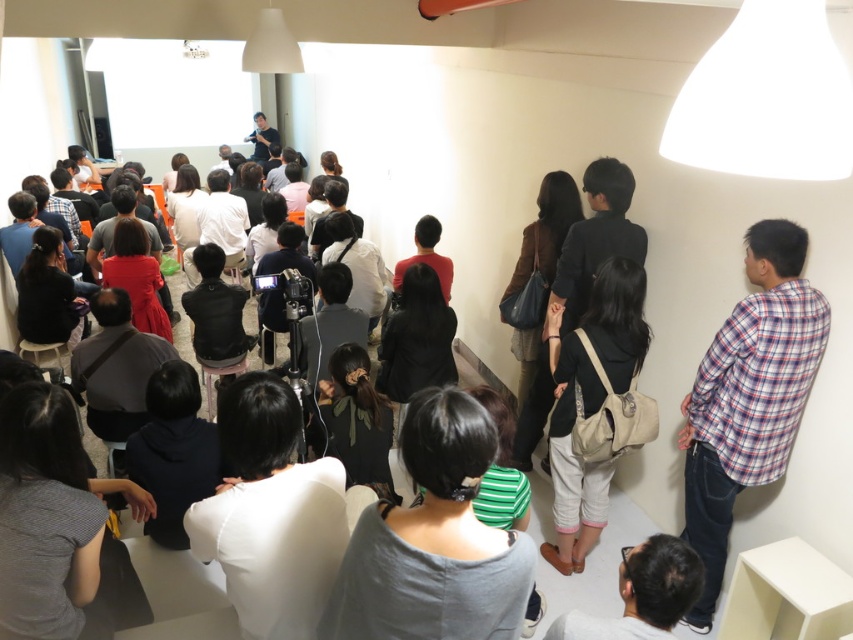
Based on the scene description, what object is located at the coordinates point (434, 541)?

The gray matte shirt at center is located at point (434, 541).

You are sitting in the front row of the room and want to hand a note to the presenter. You notice the gray matte shirt at center and the plaid fabric shirt at right. Which one is closer to you?

The gray matte shirt at center is closer to you because it is positioned under the plaid fabric shirt at right, indicating it is in front.

You are organizing a photo shoot and need to ensure that the plaid fabric shirt at right and the black matte bag at center are visible in the frame. Based on their sizes, which object should you prioritize positioning closer to the camera to maintain clarity?

The plaid fabric shirt at right has a greater height compared to the black matte bag at center, so you should prioritize positioning the plaid fabric shirt at right closer to the camera to maintain clarity.